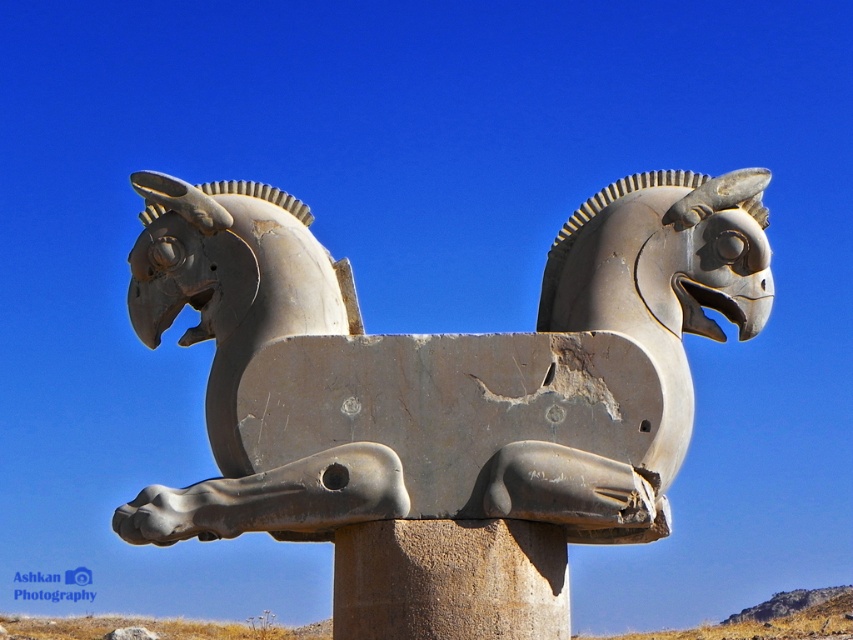
Question: Does gray stone sculpture at center have a larger size compared to rusty stone pillar at center?

Choices:
 (A) no
 (B) yes

Answer: (B)

Question: Which object is farther from the camera taking this photo?

Choices:
 (A) gray stone sculpture at center
 (B) rusty stone pillar at center

Answer: (A)

Question: Which point is farther to the camera?

Choices:
 (A) gray stone sculpture at center
 (B) rusty stone pillar at center

Answer: (A)

Question: Is gray stone sculpture at center to the right of rusty stone pillar at center from the viewer's perspective?

Choices:
 (A) no
 (B) yes

Answer: (B)

Question: Is gray stone sculpture at center above rusty stone pillar at center?

Choices:
 (A) no
 (B) yes

Answer: (B)